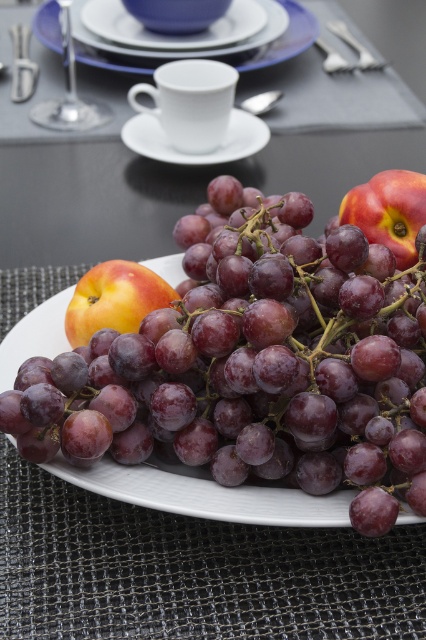
Who is taller, shiny purple grapes at center or matte peach at center?

shiny purple grapes at center is taller.

Who is more forward, (276, 458) or (141, 269)?

Positioned in front is point (276, 458).

Between point (359, 289) and point (121, 266), which one is positioned behind?

Positioned behind is point (121, 266).

At what (x,y) coordinates should I click in order to perform the action: click on shiny purple grapes at center. Please return your answer as a coordinate pair (x, y). This screenshot has height=640, width=426. Looking at the image, I should click on (264, 369).

Which is in front, point (232, 394) or point (244, 33)?

Point (232, 394) is in front.

At what (x,y) coordinates should I click in order to perform the action: click on shiny purple grapes at center. Please return your answer as a coordinate pair (x, y). Looking at the image, I should click on (264, 369).

Does point (175, 384) come farther from viewer compared to point (180, 40)?

No, it is in front of (180, 40).

Locate an element on the screen. shiny purple grapes at center is located at coordinates (264, 369).

Is point (143, 72) positioned after point (43, 120)?

Yes, point (143, 72) is farther from viewer.

Between matte white cup at upper center and metallic silver wine glass at upper left, which one is positioned lower?

metallic silver wine glass at upper left is below.

The image size is (426, 640). I want to click on matte white cup at upper center, so click(282, 38).